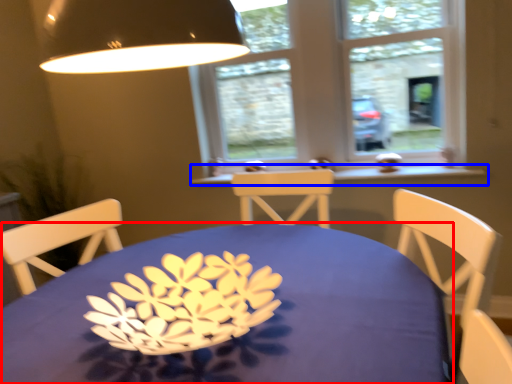
Question: Which of the following is the farthest to the observer, table (highlighted by a red box) or window sill (highlighted by a blue box)?

Choices:
 (A) table
 (B) window sill

Answer: (B)